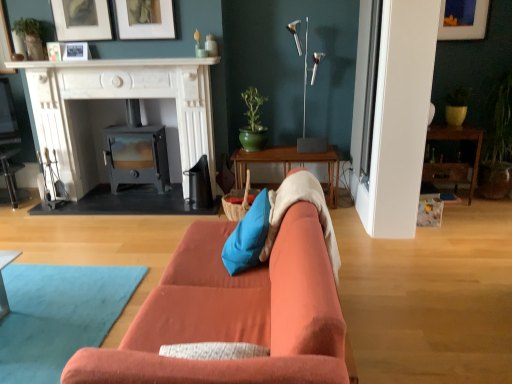
The image size is (512, 384). Describe the element at coordinates (253, 122) in the screenshot. I see `green matte pot at center, arranged as the second houseplant when viewed from the right` at that location.

Find the location of `matte white picture frame at upper center, positioned as the 2th picture frame in right-to-left order`. matte white picture frame at upper center, positioned as the 2th picture frame in right-to-left order is located at coordinates (145, 19).

How much space does matte white picture frame at upper center, which ranks as the fourth picture frame in left-to-right order, occupy vertically?

matte white picture frame at upper center, which ranks as the fourth picture frame in left-to-right order, is 13.80 inches in height.

Describe the element at coordinates (305, 105) in the screenshot. The width and height of the screenshot is (512, 384). I see `silver metallic floor lamp at upper center` at that location.

Describe the element at coordinates (459, 140) in the screenshot. I see `wooden shelf at right, which is the 1th table from right to left` at that location.

What are the coordinates of `green matte pot at center, arranged as the second houseplant when viewed from the right` in the screenshot? It's located at (253, 122).

Based on the photo, is the surface of matte white picture frame at upper left, the second picture frame when ordered from left to right, in direct contact with matte white picture frame at upper center, positioned as the 2th picture frame in right-to-left order?

No, matte white picture frame at upper left, the second picture frame when ordered from left to right, is not next to matte white picture frame at upper center, positioned as the 2th picture frame in right-to-left order.

Considering the sizes of matte white picture frame at upper left, the second picture frame when ordered from left to right, and matte white picture frame at upper center, positioned as the 2th picture frame in right-to-left order, in the image, is matte white picture frame at upper left, the second picture frame when ordered from left to right, taller or shorter than matte white picture frame at upper center, positioned as the 2th picture frame in right-to-left order,?

Clearly, matte white picture frame at upper left, the second picture frame when ordered from left to right, is shorter compared to matte white picture frame at upper center, positioned as the 2th picture frame in right-to-left order.

Does point (75, 59) come in front of point (162, 27)?

No, (75, 59) is further to viewer.

Can you confirm if matte white picture frame at upper left, the second picture frame when ordered from left to right, is bigger than matte white picture frame at upper center, positioned as the 2th picture frame in right-to-left order?

No.

From a real-world perspective, is matte white picture frame at upper left, which is counted as the fourth picture frame, starting from the right, on top of matte white picture frame at upper right, placed as the first picture frame when sorted from right to left?

Incorrect, from a real-world perspective, matte white picture frame at upper left, which is counted as the fourth picture frame, starting from the right, is lower than matte white picture frame at upper right, placed as the first picture frame when sorted from right to left.

The width and height of the screenshot is (512, 384). Find the location of `the 3rd picture frame to the left of the matte white picture frame at upper right, placed as the first picture frame when sorted from right to left, starting your count from the anchor`. the 3rd picture frame to the left of the matte white picture frame at upper right, placed as the first picture frame when sorted from right to left, starting your count from the anchor is located at coordinates (76, 51).

Would you consider matte white picture frame at upper left, which is counted as the fourth picture frame, starting from the right, to be distant from matte white picture frame at upper right, placed as the first picture frame when sorted from right to left?

matte white picture frame at upper left, which is counted as the fourth picture frame, starting from the right, is positioned a significant distance from matte white picture frame at upper right, placed as the first picture frame when sorted from right to left.

Considering the relative sizes of matte white picture frame at upper left, which is counted as the fourth picture frame, starting from the right, and matte white picture frame at upper right, which is counted as the fifth picture frame, starting from the left, in the image provided, is matte white picture frame at upper left, which is counted as the fourth picture frame, starting from the right, taller than matte white picture frame at upper right, which is counted as the fifth picture frame, starting from the left,?

No, matte white picture frame at upper left, which is counted as the fourth picture frame, starting from the right, is not taller than matte white picture frame at upper right, which is counted as the fifth picture frame, starting from the left.

Does wooden shelf at right, marked as the 2th table in a left-to-right arrangement, appear on the left side of green matte plant at upper left, which is the first houseplant from left to right?

No, wooden shelf at right, marked as the 2th table in a left-to-right arrangement, is not to the left of green matte plant at upper left, which is the first houseplant from left to right.

From the picture: Is wooden shelf at right, which is the 1th table from right to left, thinner than green matte plant at upper left, which is the first houseplant from left to right?

No, wooden shelf at right, which is the 1th table from right to left, is not thinner than green matte plant at upper left, which is the first houseplant from left to right.

In the scene shown: Between wooden shelf at right, which is the 1th table from right to left, and green matte plant at upper left, which is the 3th houseplant in right-to-left order, which one is positioned behind?

wooden shelf at right, which is the 1th table from right to left, is further from the camera.

From the image's perspective, which object appears higher, wooden shelf at right, which is the 1th table from right to left, or green matte plant at upper left, which is the 3th houseplant in right-to-left order?

green matte plant at upper left, which is the 3th houseplant in right-to-left order.

Is point (206, 65) farther from viewer compared to point (464, 107)?

No, it is in front of (464, 107).

Does white marble fireplace at upper center have a lesser height compared to yellow matte pot at right, the third houseplant from the left?

Correct, white marble fireplace at upper center is not as tall as yellow matte pot at right, the third houseplant from the left.

Looking at their sizes, would you say white marble fireplace at upper center is wider or thinner than yellow matte pot at right, which is counted as the 1th houseplant, starting from the right?

white marble fireplace at upper center is wider than yellow matte pot at right, which is counted as the 1th houseplant, starting from the right.

From the image's perspective, which is above, white marble fireplace at upper center or yellow matte pot at right, the third houseplant from the left?

white marble fireplace at upper center, from the image's perspective.

Can you confirm if blue fabric pillow at center is smaller than matte white picture frame at upper center, positioned as the 2th picture frame in right-to-left order?

Incorrect, blue fabric pillow at center is not smaller in size than matte white picture frame at upper center, positioned as the 2th picture frame in right-to-left order.

Looking at this image, is blue fabric pillow at center next to matte white picture frame at upper center, positioned as the 2th picture frame in right-to-left order?

blue fabric pillow at center and matte white picture frame at upper center, positioned as the 2th picture frame in right-to-left order, are clearly separated.

Measure the distance between blue fabric pillow at center and matte white picture frame at upper center, positioned as the 2th picture frame in right-to-left order.

They are 2.31 meters apart.

From their relative heights in the image, would you say blue fabric pillow at center is taller or shorter than matte white picture frame at upper center, positioned as the 2th picture frame in right-to-left order?

Considering their sizes, blue fabric pillow at center has less height than matte white picture frame at upper center, positioned as the 2th picture frame in right-to-left order.

Measure the distance from blue fabric pillow at center to white marble fireplace at upper center.

They are 6.85 feet apart.

Can you tell me how much blue fabric pillow at center and white marble fireplace at upper center differ in facing direction?

blue fabric pillow at center and white marble fireplace at upper center are facing 89.4 degrees away from each other.

Is blue fabric pillow at center at the left side of white marble fireplace at upper center?

No, blue fabric pillow at center is not to the left of white marble fireplace at upper center.

At what (x,y) coordinates should I click in order to perform the action: click on pillow below the white marble fireplace at upper center (from a real-world perspective). Please return your answer as a coordinate pair (x, y). Looking at the image, I should click on click(248, 237).

From their relative heights in the image, would you say green matte pot at center, which is counted as the 2th houseplant, starting from the left, is taller or shorter than white marble fireplace at left?

In the image, green matte pot at center, which is counted as the 2th houseplant, starting from the left, appears to be shorter than white marble fireplace at left.

Consider the image. From the image's perspective, which is above, green matte pot at center, which is counted as the 2th houseplant, starting from the left, or white marble fireplace at left?

green matte pot at center, which is counted as the 2th houseplant, starting from the left.

Are green matte pot at center, arranged as the second houseplant when viewed from the right, and white marble fireplace at left far apart?

Actually, green matte pot at center, arranged as the second houseplant when viewed from the right, and white marble fireplace at left are a little close together.

Is green matte pot at center, which is counted as the 2th houseplant, starting from the left, at the left side of white marble fireplace at left?

No, green matte pot at center, which is counted as the 2th houseplant, starting from the left, is not to the left of white marble fireplace at left.

I want to click on the 2nd picture frame above when counting from the matte white picture frame at upper left, the second picture frame when ordered from left to right (from the image's perspective), so click(x=145, y=19).

What are the coordinates of `the 2nd picture frame positioned above the matte white picture frame at upper left, which is counted as the fourth picture frame, starting from the right (from a real-world perspective)` in the screenshot? It's located at (463, 19).

Estimate the real-world distances between objects in this image. Which object is closer to matte black picture frame at upper left, marked as the third picture frame in a right-to-left arrangement, white marble fireplace at upper center or matte white picture frame at upper center, which ranks as the fourth picture frame in left-to-right order?

matte white picture frame at upper center, which ranks as the fourth picture frame in left-to-right order, is positioned closer to the anchor matte black picture frame at upper left, marked as the third picture frame in a right-to-left arrangement.

From the image, which object appears to be nearer to wooden table at center, which is counted as the second table, starting from the right, wooden shelf at right, marked as the 2th table in a left-to-right arrangement, or metallic gray wood burning stove at center?

metallic gray wood burning stove at center lies closer to wooden table at center, which is counted as the second table, starting from the right, than the other object.

Based on their spatial positions, is matte white picture frame at upper left, which is counted as the first picture frame, starting from the left, or wooden table at center, which appears as the 1th table when viewed from the left, further from green matte pot at center, arranged as the second houseplant when viewed from the right?

matte white picture frame at upper left, which is counted as the first picture frame, starting from the left, is further to green matte pot at center, arranged as the second houseplant when viewed from the right.

Looking at this image, based on their spatial positions, is wooden table at center, which appears as the 1th table when viewed from the left, or metallic gray wood burning stove at center closer to orange fabric couch at center?

wooden table at center, which appears as the 1th table when viewed from the left, is closer to orange fabric couch at center.

Estimate the real-world distances between objects in this image. Which object is closer to matte white picture frame at upper right, which is counted as the fifth picture frame, starting from the left, wooden shelf at right, which is the 1th table from right to left, or matte black picture frame at upper left, marked as the third picture frame in a right-to-left arrangement?

Based on the image, wooden shelf at right, which is the 1th table from right to left, appears to be nearer to matte white picture frame at upper right, which is counted as the fifth picture frame, starting from the left.

Looking at the image, which one is located further to orange fabric couch at center, white marble fireplace at left or matte white picture frame at upper center, which ranks as the fourth picture frame in left-to-right order?

matte white picture frame at upper center, which ranks as the fourth picture frame in left-to-right order, is positioned further to the anchor orange fabric couch at center.

Based on their spatial positions, is wooden table at center, which is counted as the second table, starting from the right, or matte white picture frame at upper center, which ranks as the fourth picture frame in left-to-right order, further from white marble fireplace at upper center?

wooden table at center, which is counted as the second table, starting from the right, lies further to white marble fireplace at upper center than the other object.

From the image, which object appears to be nearer to silver metallic floor lamp at upper center, green matte plant at upper left, which is the 3th houseplant in right-to-left order, or green matte pot at center, arranged as the second houseplant when viewed from the right?

green matte pot at center, arranged as the second houseplant when viewed from the right, is closer to silver metallic floor lamp at upper center.

At what (x,y) coordinates should I click in order to perform the action: click on studio couch located between matte black picture frame at upper left, marked as the third picture frame in a right-to-left arrangement, and wooden shelf at right, which is the 1th table from right to left, in the left-right direction. Please return your answer as a coordinate pair (x, y). Image resolution: width=512 pixels, height=384 pixels. Looking at the image, I should click on (234, 314).

I want to click on houseplant between metallic gray wood burning stove at center and silver metallic floor lamp at upper center from left to right, so click(x=253, y=122).

Identify the location of houseplant between orange fabric couch at center and matte white picture frame at upper center, positioned as the 2th picture frame in right-to-left order, in the front-back direction. (30, 36).

Identify the location of picture frame located between white marble fireplace at upper center and wooden table at center, which appears as the 1th table when viewed from the left, in the left-right direction. Image resolution: width=512 pixels, height=384 pixels. (145, 19).